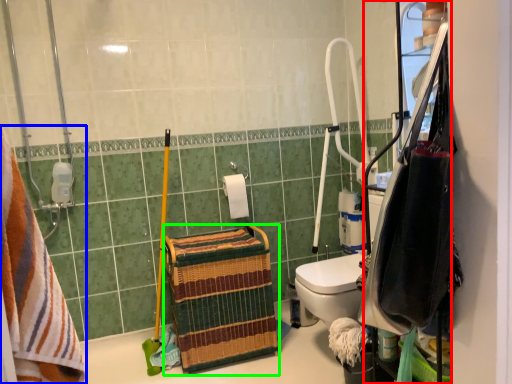
Question: Which object is the closest to the cabinetry (highlighted by a red box)? Choose among these: towel (highlighted by a blue box) or basket (highlighted by a green box).

Choices:
 (A) towel
 (B) basket

Answer: (A)